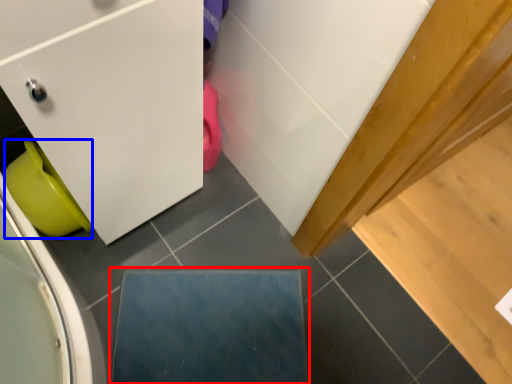
Question: Among these objects, which one is nearest to the camera, slate (highlighted by a red box) or toilet bowl (highlighted by a blue box)?

Choices:
 (A) slate
 (B) toilet bowl

Answer: (B)